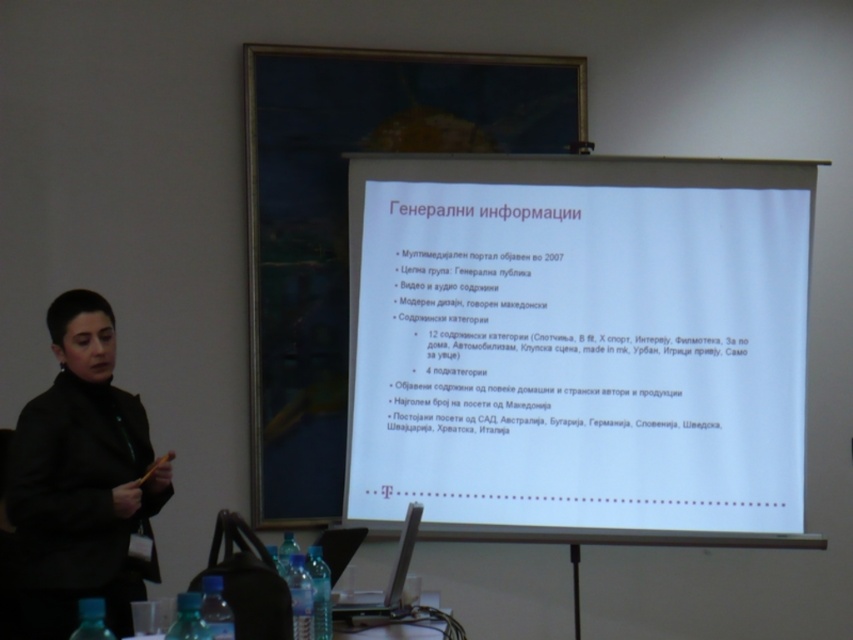
Can you confirm if white paper at center is positioned to the right of black matte jacket at left?

Indeed, white paper at center is positioned on the right side of black matte jacket at left.

Measure the distance between white paper at center and camera.

A distance of 4.01 meters exists between white paper at center and camera.

Looking at this image, measure the distance between white paper at center and camera.

13.16 feet

Find the location of a particular element. The image size is (853, 640). white paper at center is located at coordinates (579, 348).